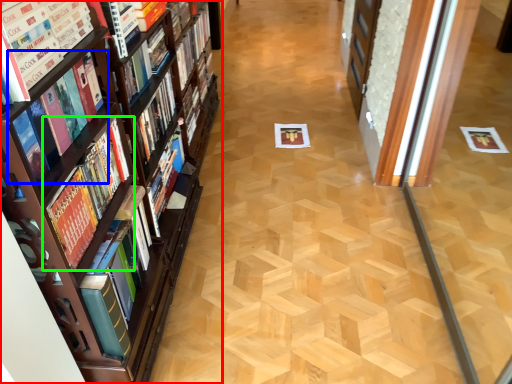
Question: Which object is the closest to the book (highlighted by a red box)? Choose among these: book (highlighted by a blue box) or book (highlighted by a green box).

Choices:
 (A) book
 (B) book

Answer: (B)